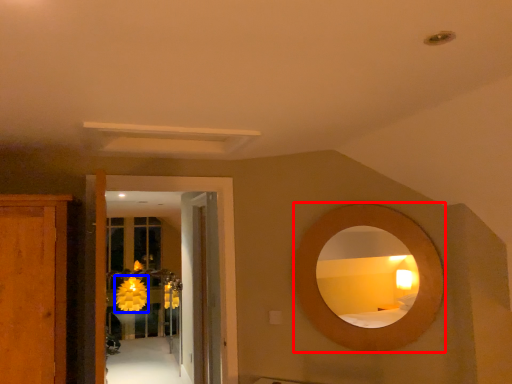
Question: Which point is closer to the camera, mirror (highlighted by a red box) or flower (highlighted by a blue box)?

Choices:
 (A) mirror
 (B) flower

Answer: (A)